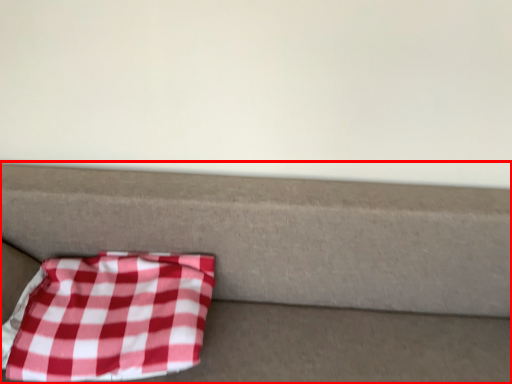
Question: From the image's perspective, where is furniture (annotated by the red box) located relative to blanket?

Choices:
 (A) above
 (B) below

Answer: (B)